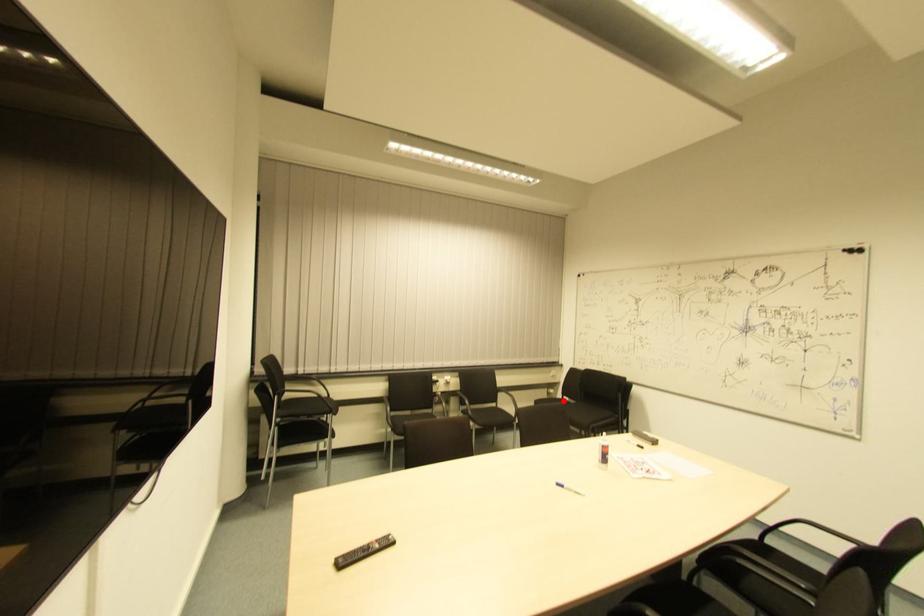
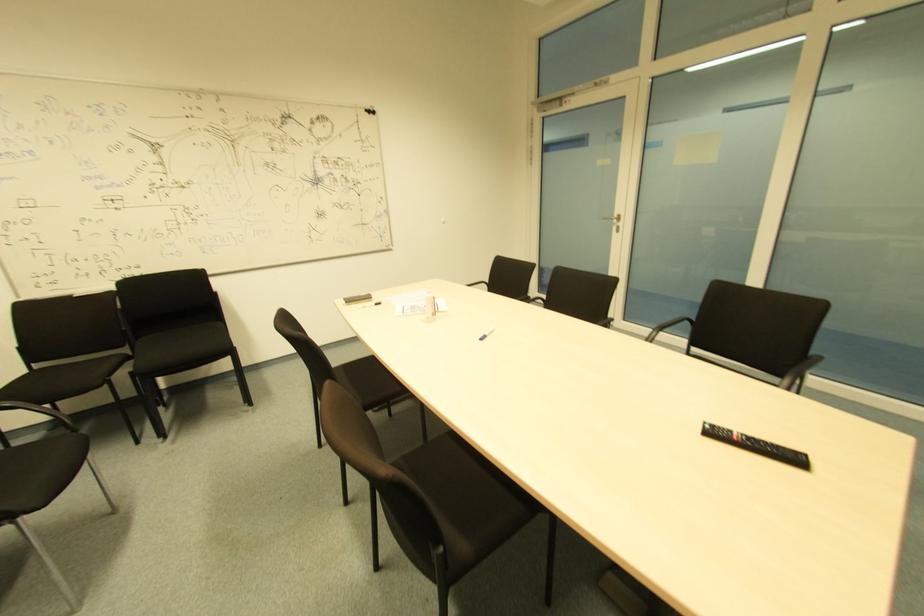
Find the pixel in the second image that matches the highlighted location in the first image.

(34, 370)